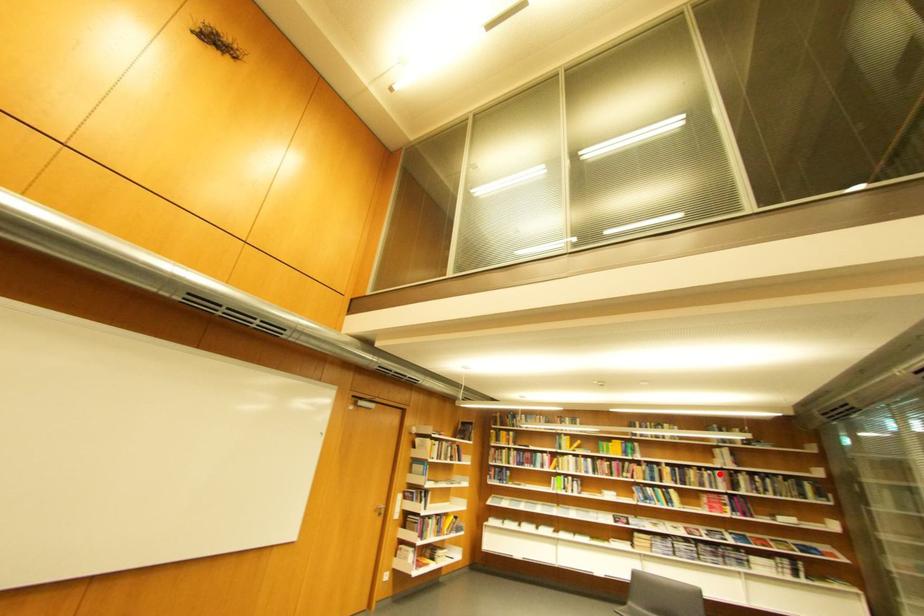
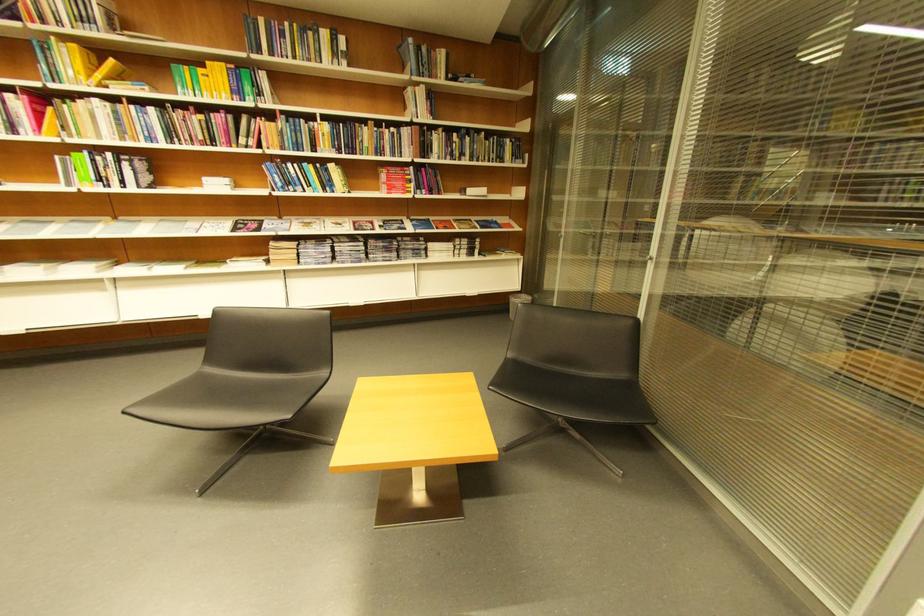
Locate, in the second image, the point that corresponds to the highlighted location in the first image.

(403, 131)